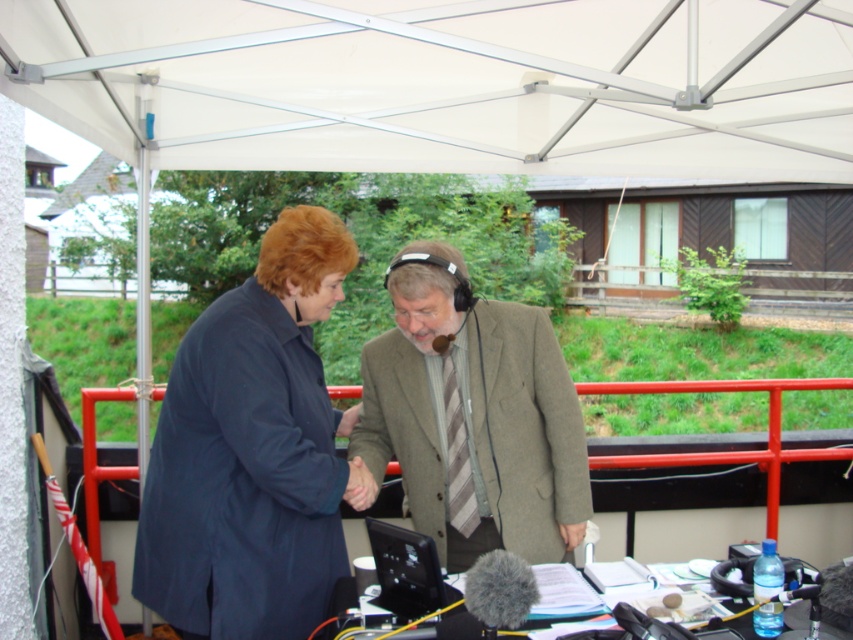
Does white fabric canopy at upper center come in front of light brown textured coat at center?

Yes, it is.

What do you see at coordinates (447, 83) in the screenshot? The image size is (853, 640). I see `white fabric canopy at upper center` at bounding box center [447, 83].

Is point (740, 120) farther from camera compared to point (463, 428)?

Yes, point (740, 120) is behind point (463, 428).

The height and width of the screenshot is (640, 853). What are the coordinates of `white fabric canopy at upper center` in the screenshot? It's located at (447, 83).

Is white fabric canopy at upper center smaller than dark blue coat at center?

Actually, white fabric canopy at upper center might be larger than dark blue coat at center.

Does white fabric canopy at upper center appear on the right side of dark blue coat at center?

Indeed, white fabric canopy at upper center is positioned on the right side of dark blue coat at center.

Image resolution: width=853 pixels, height=640 pixels. What are the coordinates of `white fabric canopy at upper center` in the screenshot? It's located at 447,83.

Does dark blue coat at center have a greater height compared to light brown textured coat at center?

Correct, dark blue coat at center is much taller as light brown textured coat at center.

Who is more distant from viewer, (221, 573) or (576, 488)?

The point (576, 488) is more distant.

Describe the element at coordinates (251, 451) in the screenshot. Image resolution: width=853 pixels, height=640 pixels. I see `dark blue coat at center` at that location.

Find the location of a particular element. dark blue coat at center is located at coordinates (251, 451).